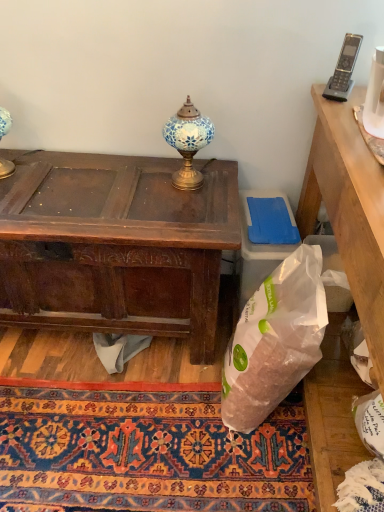
Identify the location of vacant point above carpet with intricate patterns at lower center (from a real-world perspective). The height and width of the screenshot is (512, 384). (130, 400).